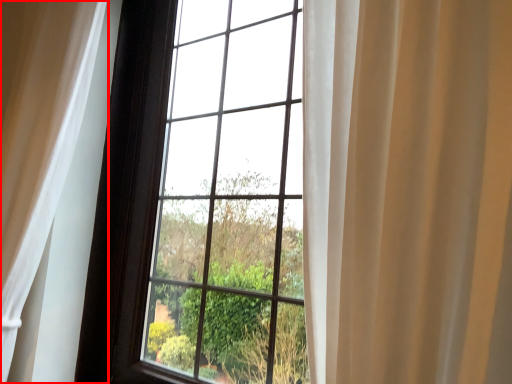
Question: From the image's perspective, where is curtain (annotated by the red box) located relative to bay window?

Choices:
 (A) above
 (B) below

Answer: (A)